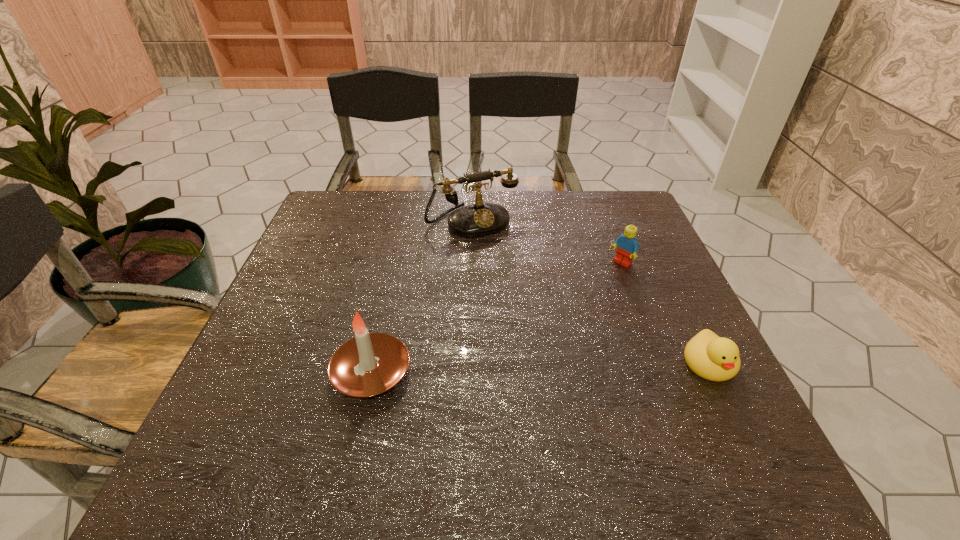
Identify the location of vacant space in between the telephone and the rightmost object. The width and height of the screenshot is (960, 540). (590, 293).

Where is `free spot between the telephone and the candle`? The height and width of the screenshot is (540, 960). free spot between the telephone and the candle is located at coordinates (421, 297).

The image size is (960, 540). Identify the location of free space between the shortest object and the candle. (540, 368).

This screenshot has width=960, height=540. In order to click on free spot between the telephone and the Lego in this screenshot , I will do `click(546, 242)`.

In order to click on object that is the closest to the duckling in this screenshot , I will do `click(627, 247)`.

At what (x,y) coordinates should I click in order to perform the action: click on object that is the second closest one to the shortest object. Please return your answer as a coordinate pair (x, y). This screenshot has height=540, width=960. Looking at the image, I should click on (479, 219).

Where is `vacant space that satisfies the following two spatial constraints: 1. on the back side of the candle; 2. on the right side of the Lego`? This screenshot has height=540, width=960. vacant space that satisfies the following two spatial constraints: 1. on the back side of the candle; 2. on the right side of the Lego is located at coordinates click(396, 264).